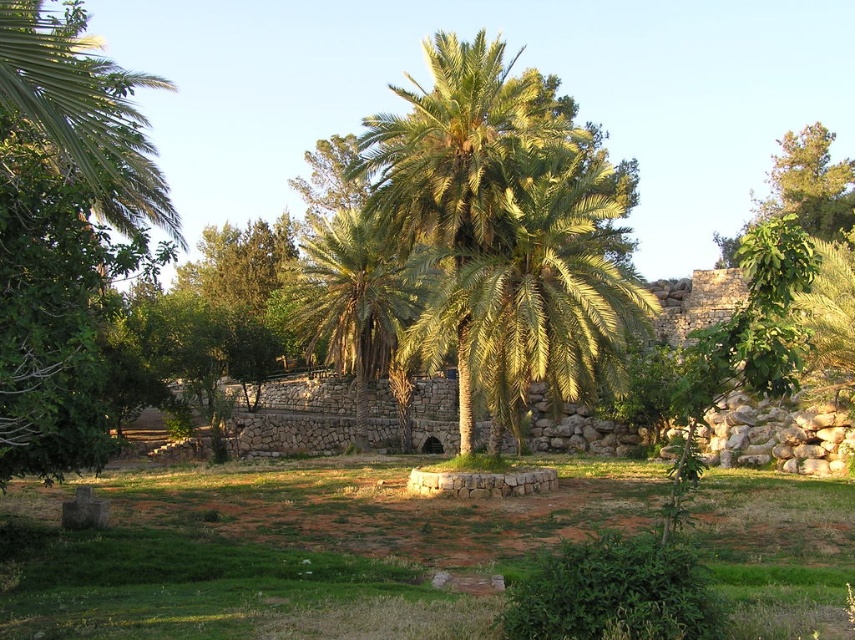
Question: Does green grass at center have a smaller size compared to green leafy palm tree at center?

Choices:
 (A) yes
 (B) no

Answer: (A)

Question: Among these points, which one is farthest from the camera?

Choices:
 (A) (308, 493)
 (B) (340, 321)
 (C) (594, 234)
 (D) (30, 156)

Answer: (B)

Question: Considering the real-world distances, which object is closest to the green grass at center?

Choices:
 (A) green leafy palm tree at center
 (B) green leafy palm at center

Answer: (B)

Question: Is green leafy tree at left further to the viewer compared to green leafy palm at center?

Choices:
 (A) no
 (B) yes

Answer: (A)

Question: Which of the following is the farthest from the observer?

Choices:
 (A) (340, 596)
 (B) (13, 97)
 (C) (475, 380)
 (D) (367, 378)

Answer: (D)

Question: Can you confirm if green grass at center is positioned above green leafy palm at center?

Choices:
 (A) no
 (B) yes

Answer: (A)